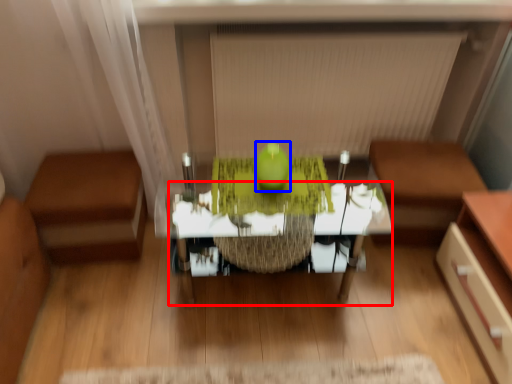
Question: Which object is further to the camera taking this photo, table (highlighted by a red box) or apple (highlighted by a blue box)?

Choices:
 (A) table
 (B) apple

Answer: (B)